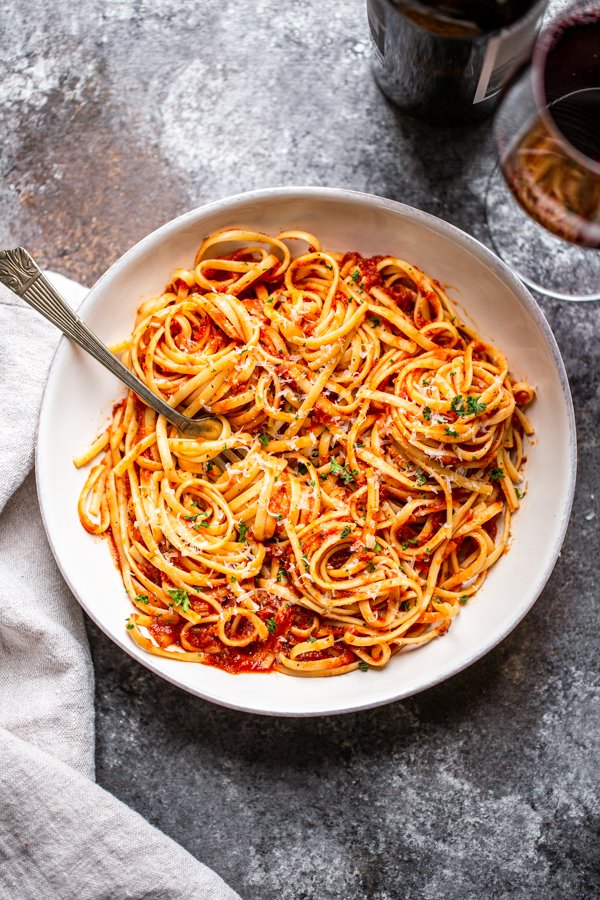
Where is `bowl`? Image resolution: width=600 pixels, height=900 pixels. bowl is located at coordinates (81, 406).